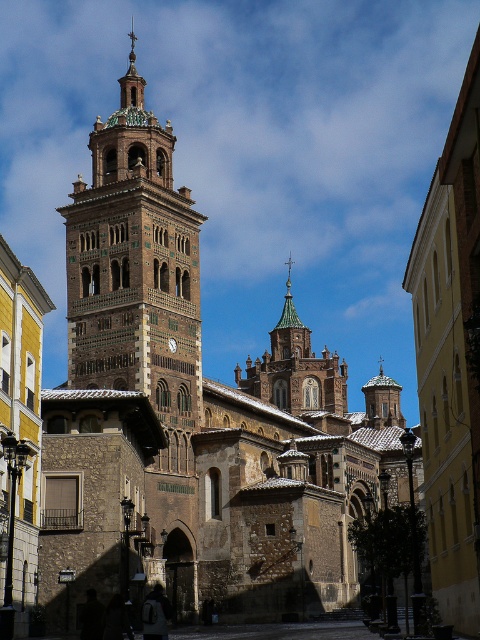
You are an architect analyzing the spires of the historic building. Which spire, the green copper spire at center or the gold textured spire at upper center, has a greater height?

The gold textured spire at upper center is taller than the green copper spire at center.

You are a drone operator tasked with capturing aerial footage of the historic site. Your drone has a maximum flight range of 100 meters. You see the green copper spire at center in the scene. Can your drone safely fly to the spire and return without exceeding its range limit?

The green copper spire at center is 102.42 meters from the camera. Since the drone can only fly up to 100 meters, it cannot safely reach the spire without exceeding its range limit. Therefore, the drone cannot safely fly to the spire and return.

You are an architect analyzing the spires of this historic building. Which spire is positioned to the right when comparing the green copper spire at center and the gold textured spire at upper center?

The green copper spire at center is positioned to the right of the gold textured spire at upper center.